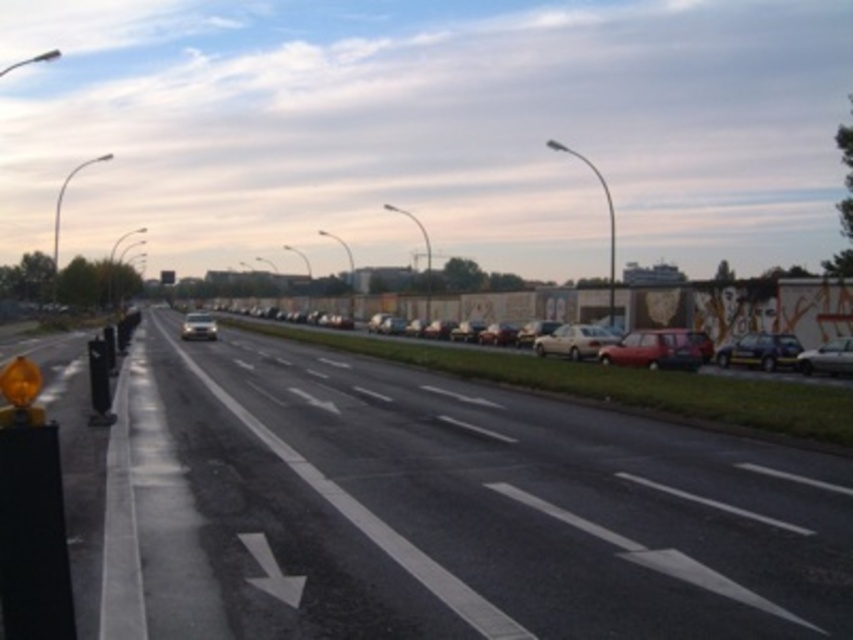
Consider the image. Between shiny red car at right and matte silver sedan at center, which one appears on the left side from the viewer's perspective?

matte silver sedan at center is more to the left.

Between shiny red car at right and matte silver sedan at center, which one is positioned lower?

shiny red car at right

Does point (645, 358) come closer to viewer compared to point (579, 337)?

Yes, it is.

Locate an element on the screen. shiny red car at right is located at coordinates (654, 349).

Which of these two, matte silver sedan at center or shiny silver sedan at right, stands shorter?

With less height is matte silver sedan at center.

Who is taller, matte silver sedan at center or shiny silver sedan at right?

shiny silver sedan at right

Where is `matte silver sedan at center`? matte silver sedan at center is located at coordinates (573, 340).

Is metallic silver car at center taller than matte silver sedan at center?

Indeed, metallic silver car at center has a greater height compared to matte silver sedan at center.

Who is shorter, metallic silver car at center or matte silver sedan at center?

matte silver sedan at center

Image resolution: width=853 pixels, height=640 pixels. Describe the element at coordinates (776, 376) in the screenshot. I see `metallic silver car at center` at that location.

At what (x,y) coordinates should I click in order to perform the action: click on metallic silver car at center. Please return your answer as a coordinate pair (x, y). The height and width of the screenshot is (640, 853). Looking at the image, I should click on (776, 376).